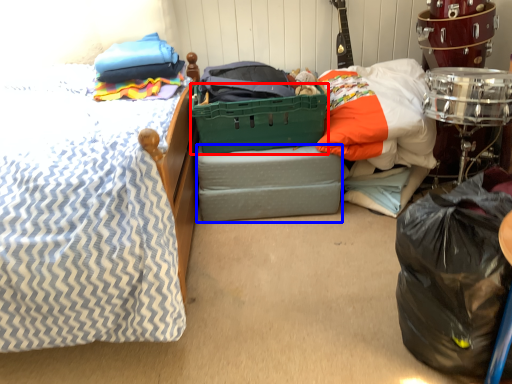
Question: Which object is further to the camera taking this photo, basket (highlighted by a red box) or storage box (highlighted by a blue box)?

Choices:
 (A) basket
 (B) storage box

Answer: (B)